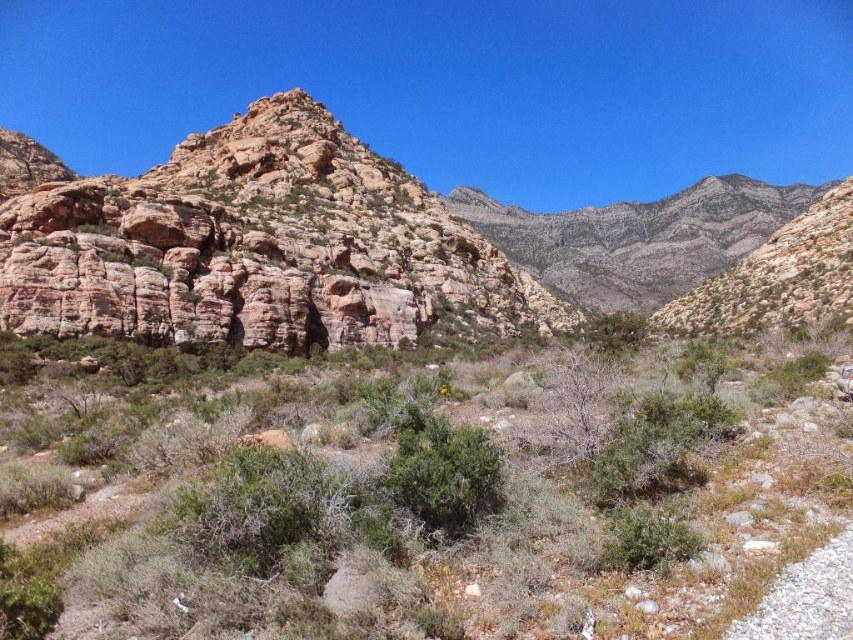
Question: Is green shrubs at center further to the viewer compared to rusty rock formation at left?

Choices:
 (A) no
 (B) yes

Answer: (A)

Question: Which point is farther to the camera?

Choices:
 (A) rusty rock formation at left
 (B) green shrubs at center

Answer: (A)

Question: Which object is farther from the camera taking this photo?

Choices:
 (A) green shrubs at center
 (B) rusty rock formation at left

Answer: (B)

Question: Does green shrubs at center appear over rusty rock formation at left?

Choices:
 (A) no
 (B) yes

Answer: (A)

Question: Does green shrubs at center have a lesser width compared to rusty rock formation at left?

Choices:
 (A) no
 (B) yes

Answer: (B)